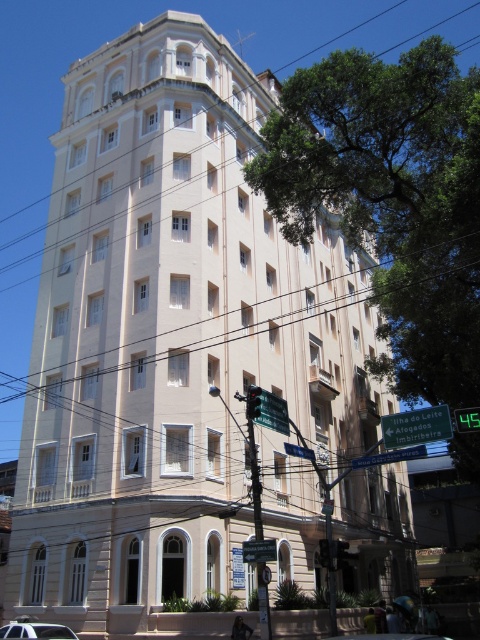
Question: Which point is closer to the camera?

Choices:
 (A) (7, 627)
 (B) (407, 424)
 (C) (434, 637)

Answer: (B)

Question: Which point is closer to the camera?

Choices:
 (A) (396, 634)
 (B) (361, 465)
 (C) (24, 627)

Answer: (B)

Question: Observing the image, what is the correct spatial positioning of metallic silver car at lower left in reference to metallic silver car at center?

Choices:
 (A) right
 (B) left

Answer: (B)

Question: Considering the real-world distances, which object is closest to the metallic silver car at center?

Choices:
 (A) green plastic street sign at center
 (B) green plastic sign at center

Answer: (A)

Question: Does green plastic sign at center have a larger size compared to green plastic street sign at center?

Choices:
 (A) yes
 (B) no

Answer: (B)

Question: Does green plastic sign at center have a larger size compared to green plastic street sign at center?

Choices:
 (A) no
 (B) yes

Answer: (A)